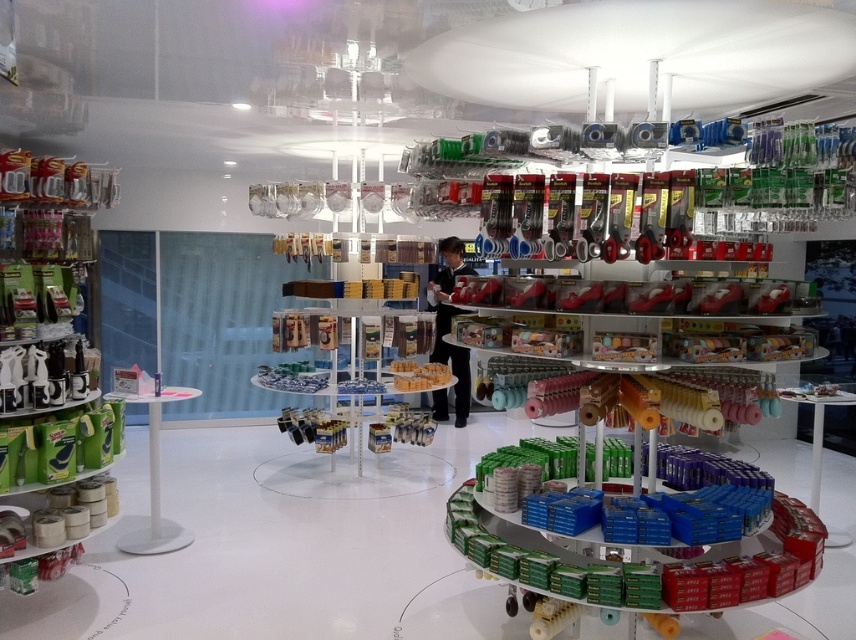
Who is shorter, green matte tape at left or clear plastic shelf at center?

With less height is clear plastic shelf at center.

Measure the distance between point (24, 301) and camera.

3.19 meters

The width and height of the screenshot is (856, 640). What are the coordinates of `green matte tape at left` in the screenshot? It's located at (49, 326).